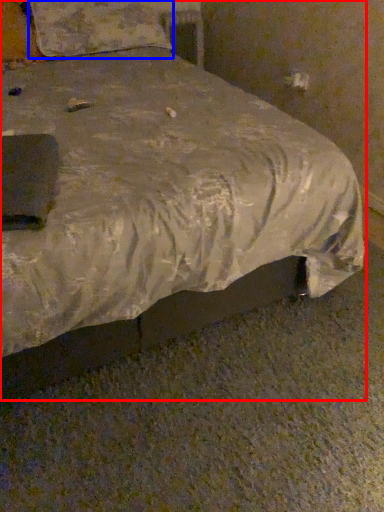
Question: Which object appears farthest to the camera in this image, bed (highlighted by a red box) or pillow (highlighted by a blue box)?

Choices:
 (A) bed
 (B) pillow

Answer: (B)